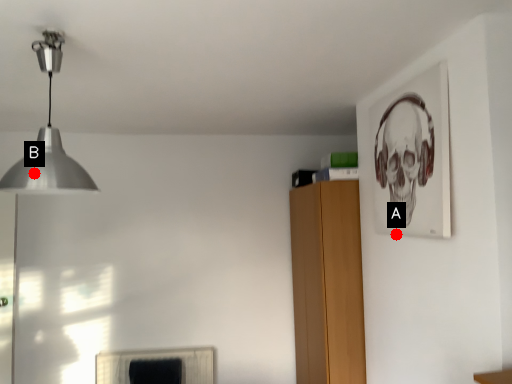
Question: Two points are circled on the image, labeled by A and B beside each circle. Among these points, which one is nearest to the camera?

Choices:
 (A) A is closer
 (B) B is closer

Answer: (B)